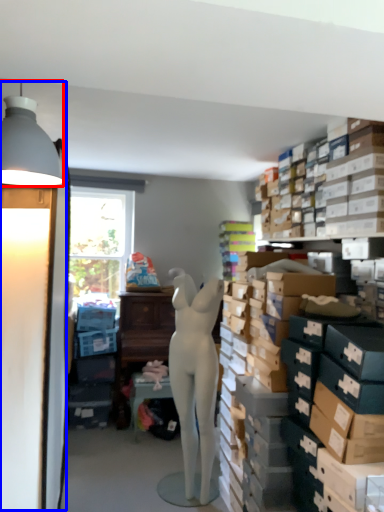
Question: Which object appears closest to the camera in this image, lamp (highlighted by a red box) or table lamp (highlighted by a blue box)?

Choices:
 (A) lamp
 (B) table lamp

Answer: (A)